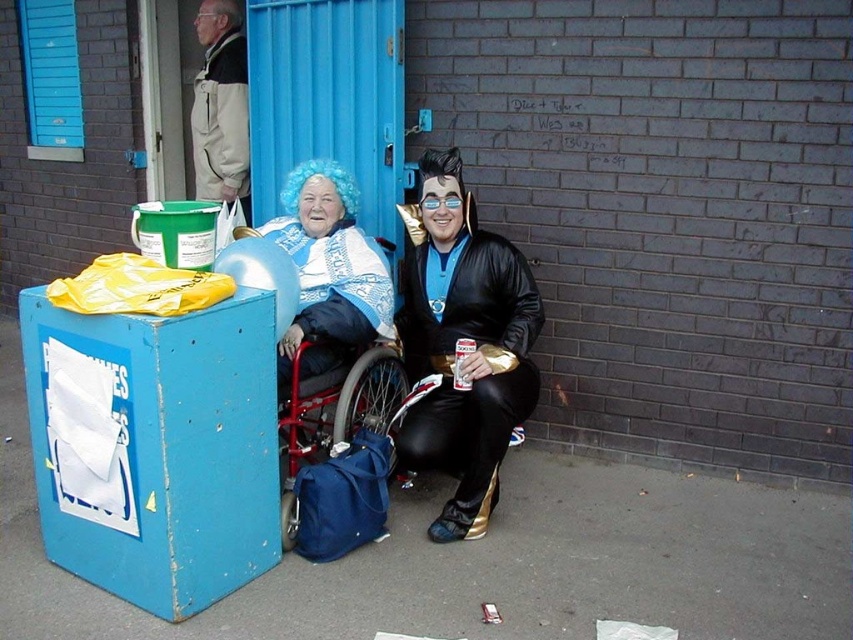
Question: Does concrete pavement at lower center appear on the right side of blue fuzzy wig at upper center?

Choices:
 (A) no
 (B) yes

Answer: (B)

Question: From the image, what is the correct spatial relationship of shiny black costume at center in relation to reddish-brown plastic wheelchair at center-left?

Choices:
 (A) right
 (B) left

Answer: (A)

Question: Is shiny black costume at center positioned in front of light beige jacket at upper left?

Choices:
 (A) yes
 (B) no

Answer: (A)

Question: Which of the following is the closest to the observer?

Choices:
 (A) (339, 381)
 (B) (318, 275)
 (C) (646, 532)
 (D) (225, 188)

Answer: (C)

Question: Estimate the real-world distances between objects in this image. Which object is closer to the blue fuzzy wig at upper center?

Choices:
 (A) reddish-brown plastic wheelchair at center-left
 (B) concrete pavement at lower center
 (C) shiny black costume at center

Answer: (A)

Question: Which of the following is the closest to the observer?

Choices:
 (A) (4, 472)
 (B) (190, 109)

Answer: (A)